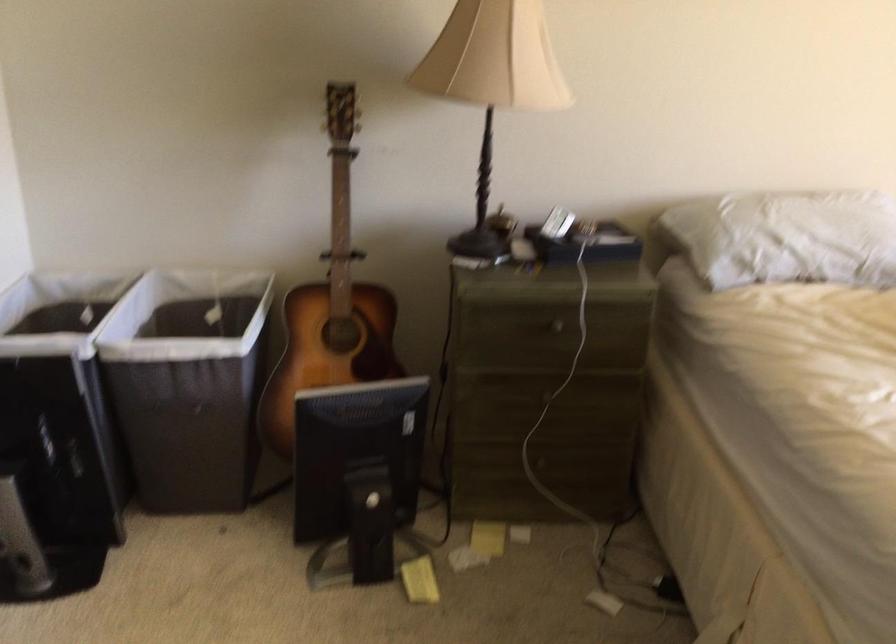
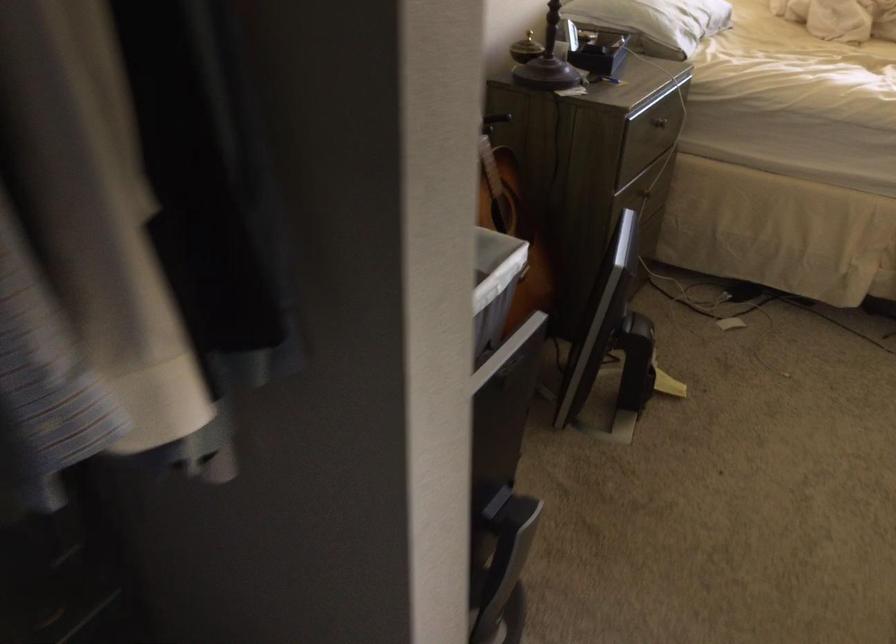
In the second image, find the point that corresponds to pixel 556 323 in the first image.

(659, 122)